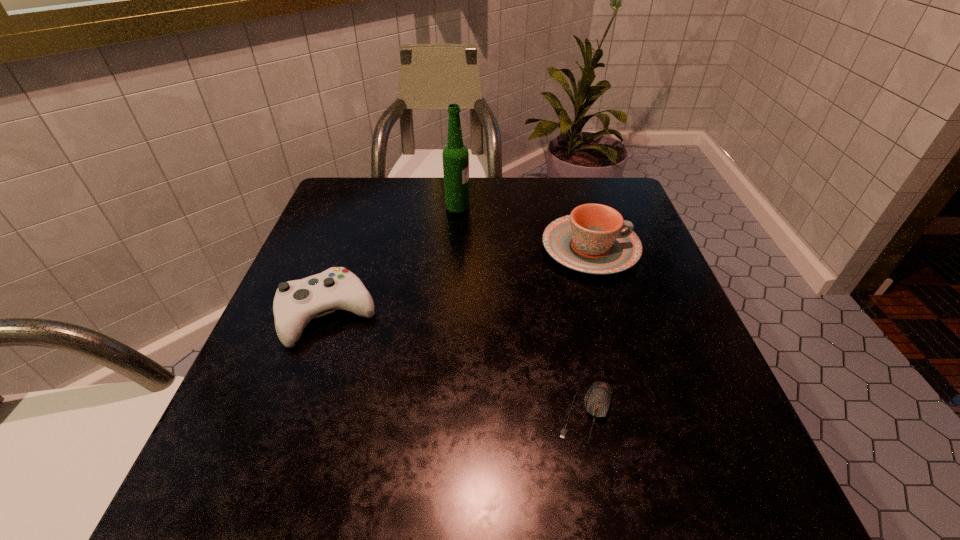
The height and width of the screenshot is (540, 960). In order to click on vacant area between the tallest object and the third shortest object in this screenshot , I will do `click(524, 227)`.

Find the location of a particular element. This screenshot has width=960, height=540. free space between the shortest object and the third shortest object is located at coordinates pos(588,330).

Identify which object is the second closest to the chinaware. Please provide its 2D coordinates. Your answer should be formatted as a tuple, i.e. [(x, y)], where the tuple contains the x and y coordinates of a point satisfying the conditions above.

[(597, 401)]

Locate which object ranks in proximity to the second nearest object. Please provide its 2D coordinates. Your answer should be formatted as a tuple, i.e. [(x, y)], where the tuple contains the x and y coordinates of a point satisfying the conditions above.

[(455, 155)]

The height and width of the screenshot is (540, 960). I want to click on vacant point that satisfies the following two spatial constraints: 1. on the label of the nearest object; 2. on the right side of the third object from right to left, so click(444, 413).

At what (x,y) coordinates should I click in order to perform the action: click on blank area in the image that satisfies the following two spatial constraints: 1. on the label of the mouse; 2. on the right side of the third object from right to left. Please return your answer as a coordinate pair (x, y). Image resolution: width=960 pixels, height=540 pixels. Looking at the image, I should click on (444, 413).

Identify the location of vacant space that satisfies the following two spatial constraints: 1. on the handle side of the second farthest object; 2. on the front side of the control. Image resolution: width=960 pixels, height=540 pixels. (611, 315).

Locate an element on the screen. vacant area that satisfies the following two spatial constraints: 1. on the front side of the mouse; 2. on the left side of the control is located at coordinates (294, 413).

Find the location of a particular element. This screenshot has width=960, height=540. blank area in the image that satisfies the following two spatial constraints: 1. on the label of the third object from right to left; 2. on the back side of the shortest object is located at coordinates (444, 413).